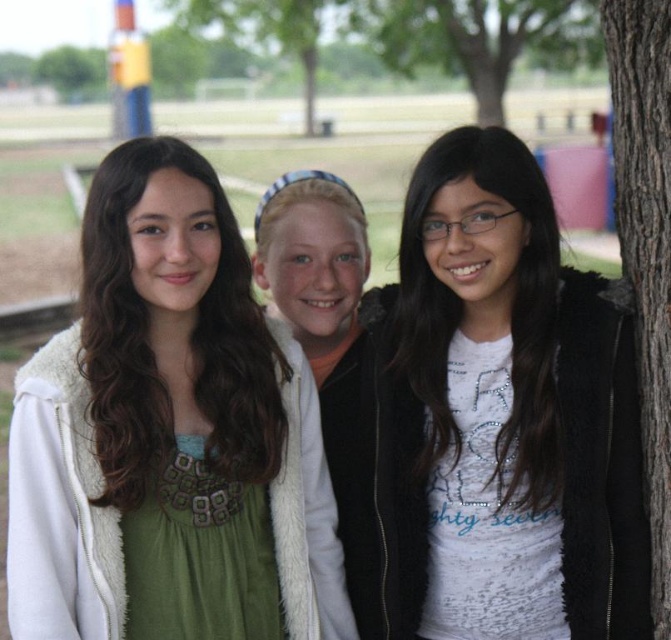
Can you confirm if white matte jacket at center is positioned above brown textured tree trunk at upper center?

Actually, white matte jacket at center is below brown textured tree trunk at upper center.

Who is more distant from viewer, (425, 404) or (474, 1)?

Point (474, 1)

At what (x,y) coordinates should I click in order to perform the action: click on white matte jacket at center. Please return your answer as a coordinate pair (x, y). Looking at the image, I should click on (501, 403).

Is white matte jacket at center bigger than green leafy tree at upper center?

Actually, white matte jacket at center might be smaller than green leafy tree at upper center.

Is white matte jacket at center above green leafy tree at upper center?

Actually, white matte jacket at center is below green leafy tree at upper center.

The width and height of the screenshot is (671, 640). Find the location of `white matte jacket at center`. white matte jacket at center is located at coordinates (501, 403).

Locate an element on the screen. Image resolution: width=671 pixels, height=640 pixels. white matte jacket at center is located at coordinates (501, 403).

What are the coordinates of `white matte jacket at center` in the screenshot? It's located at (501, 403).